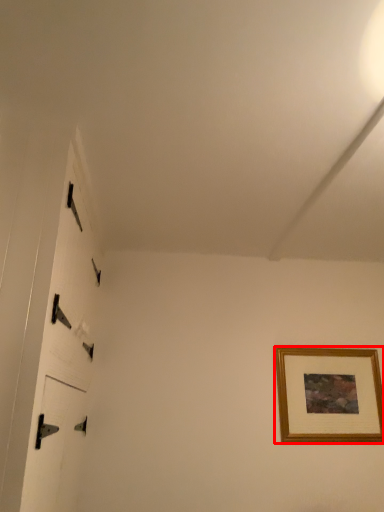
Question: Considering the relative positions of picture frame (annotated by the red box) and door in the image provided, where is picture frame (annotated by the red box) located with respect to the staircase?

Choices:
 (A) right
 (B) left

Answer: (A)